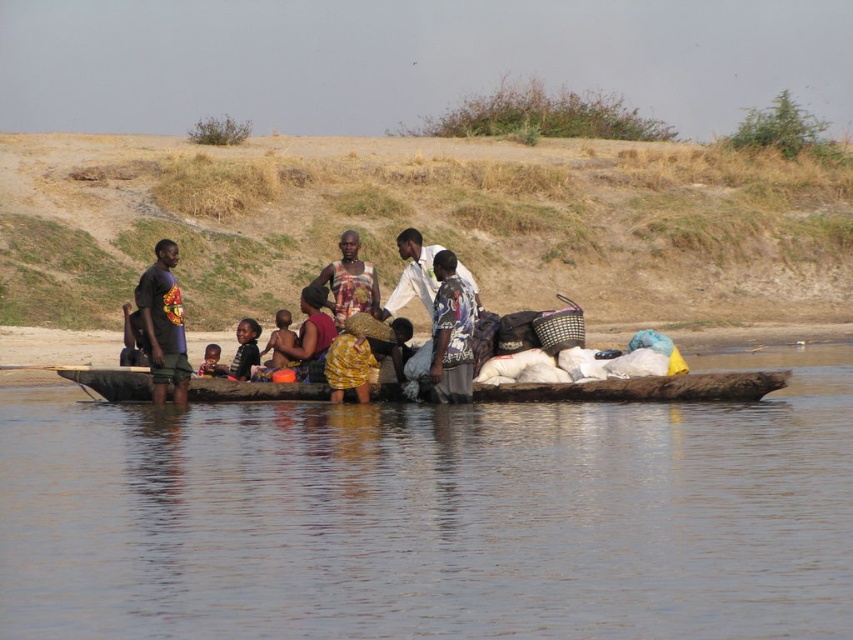
Question: Is brown wooden boat at center positioned behind printed fabric basket at center?

Choices:
 (A) no
 (B) yes

Answer: (A)

Question: Can you confirm if printed fabric basket at center is positioned below printed fabric dress at center?

Choices:
 (A) no
 (B) yes

Answer: (B)

Question: Does matte black t-shirt at left appear on the right side of printed fabric dress at center?

Choices:
 (A) no
 (B) yes

Answer: (A)

Question: Which of the following is the farthest from the observer?

Choices:
 (A) matte black t-shirt at left
 (B) brown wooden boat at center
 (C) brown wooden canoe at center

Answer: (A)

Question: Among these points, which one is farthest from the camera?

Choices:
 (A) pos(106,400)
 (B) pos(454,266)
 (C) pos(149,314)

Answer: (A)

Question: Which of the following is the closest to the observer?

Choices:
 (A) printed fabric basket at center
 (B) brown wooden boat at center

Answer: (B)